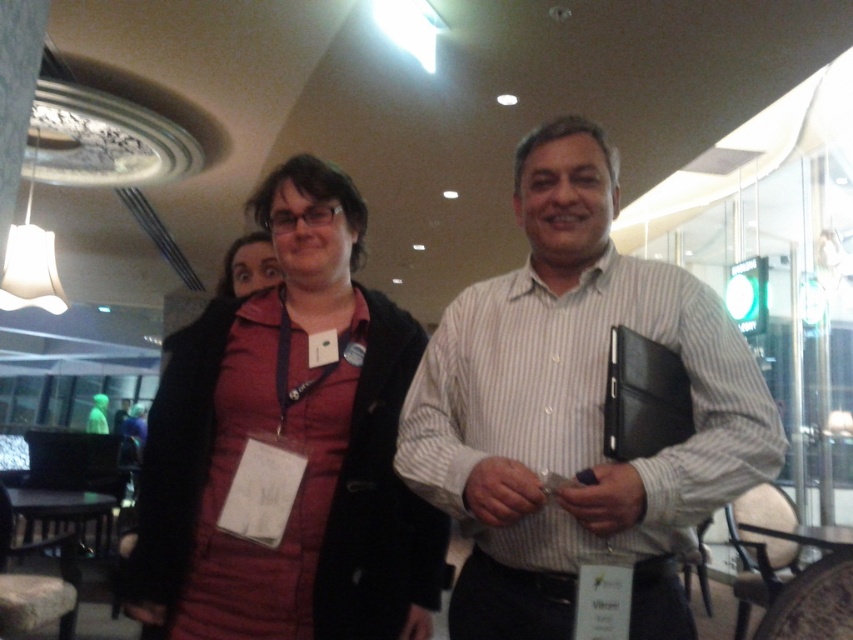
Who is lower down, matte red vest at center or matte red coat at center?

Positioned lower is matte red vest at center.

In the scene shown: Which of these two, matte red vest at center or matte red coat at center, stands taller?

With more height is matte red vest at center.

Which is behind, point (314, 611) or point (231, 285)?

The point (231, 285) is behind.

At what (x,y) coordinates should I click in order to perform the action: click on matte red vest at center. Please return your answer as a coordinate pair (x, y). The image size is (853, 640). Looking at the image, I should click on (293, 448).

Is matte black folder at center smaller than matte red coat at center?

No.

Is point (463, 413) farther from viewer compared to point (260, 243)?

No, it is in front of (260, 243).

Is point (601, 364) closer to viewer compared to point (233, 253)?

That is True.

Identify the location of matte black folder at center. Image resolution: width=853 pixels, height=640 pixels. (572, 403).

Between point (722, 500) and point (318, 472), which one is positioned in front?

Point (722, 500) is more forward.

Can you confirm if matte black folder at center is shorter than matte red vest at center?

Yes.

What do you see at coordinates (572, 403) in the screenshot?
I see `matte black folder at center` at bounding box center [572, 403].

The height and width of the screenshot is (640, 853). In order to click on matte black folder at center in this screenshot , I will do `click(572, 403)`.